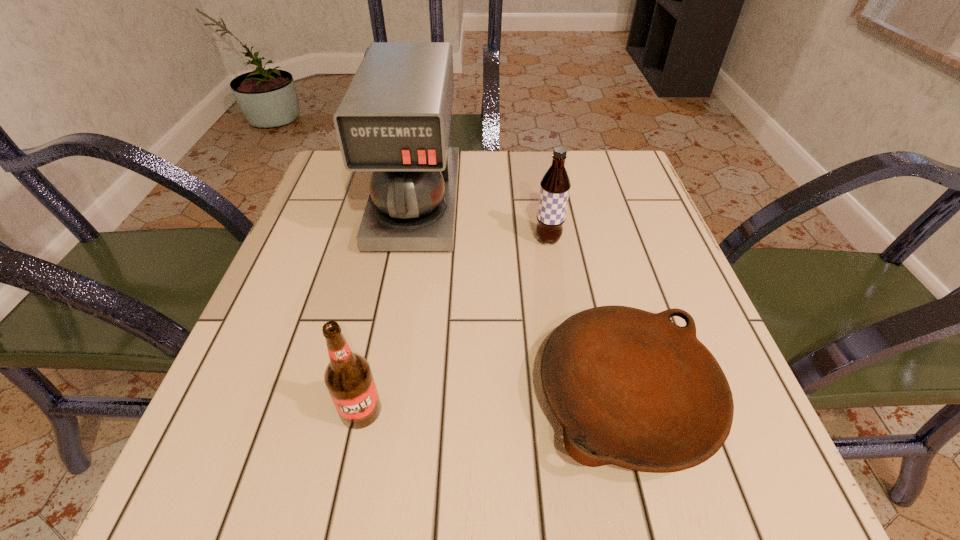
Locate an element on the screen. coffee maker is located at coordinates (394, 119).

Locate an element on the screen. The width and height of the screenshot is (960, 540). the right root beer is located at coordinates (555, 185).

Find the location of a particular element. The image size is (960, 540). the nearer root beer is located at coordinates (348, 377).

Where is `plate`? plate is located at coordinates (636, 390).

Locate an element on the screen. vacant space located on the carafe side of the coffee maker is located at coordinates tap(389, 360).

What are the coordinates of `vacant point located 0.080m on the right of the right root beer` in the screenshot? It's located at (600, 239).

I want to click on vacant point located 0.320m on the right of the nearer root beer, so click(x=600, y=411).

Locate an element on the screen. The width and height of the screenshot is (960, 540). free space located on the back of the shortest object is located at coordinates (595, 278).

At what (x,y) coordinates should I click in order to perform the action: click on object present at the far edge. Please return your answer as a coordinate pair (x, y). The height and width of the screenshot is (540, 960). Looking at the image, I should click on (394, 119).

Find the location of `object present at the near edge`. object present at the near edge is located at coordinates (636, 390).